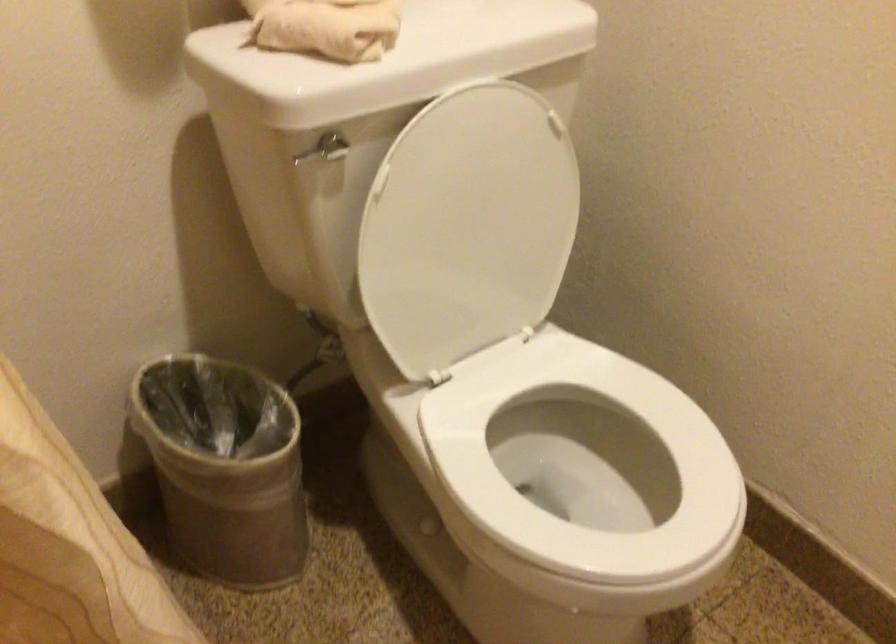
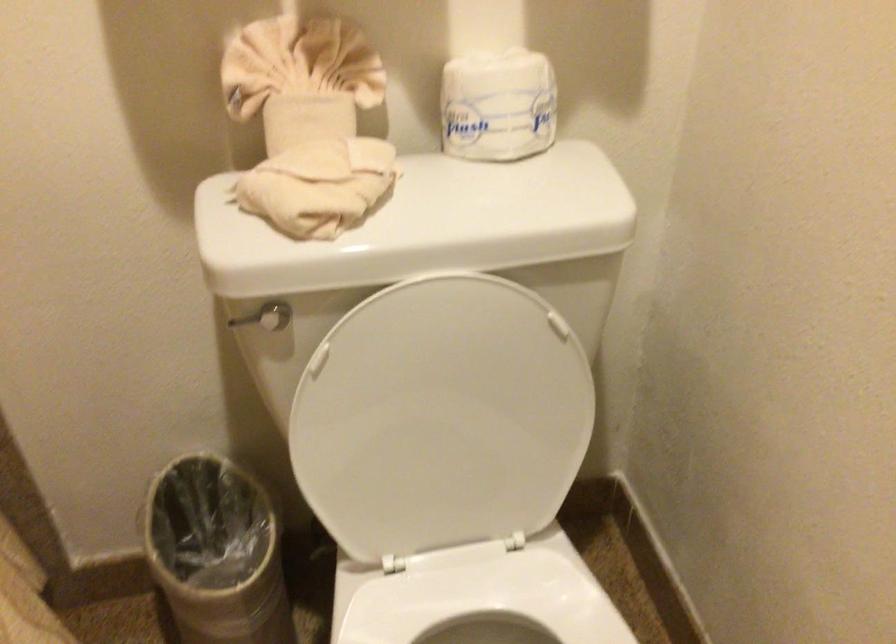
Which direction would the cameraman need to move to produce the second image?

The cameraman moved toward right, forward.